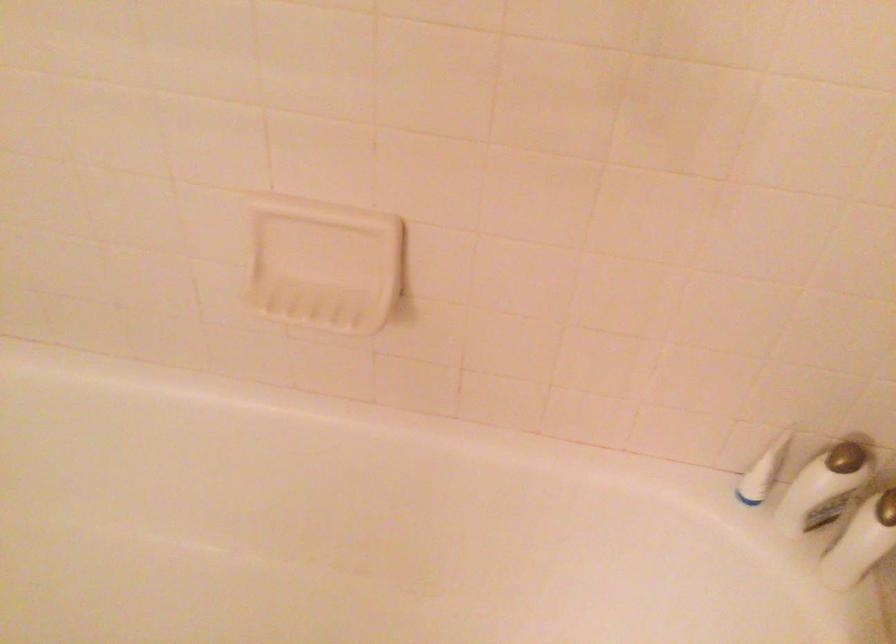
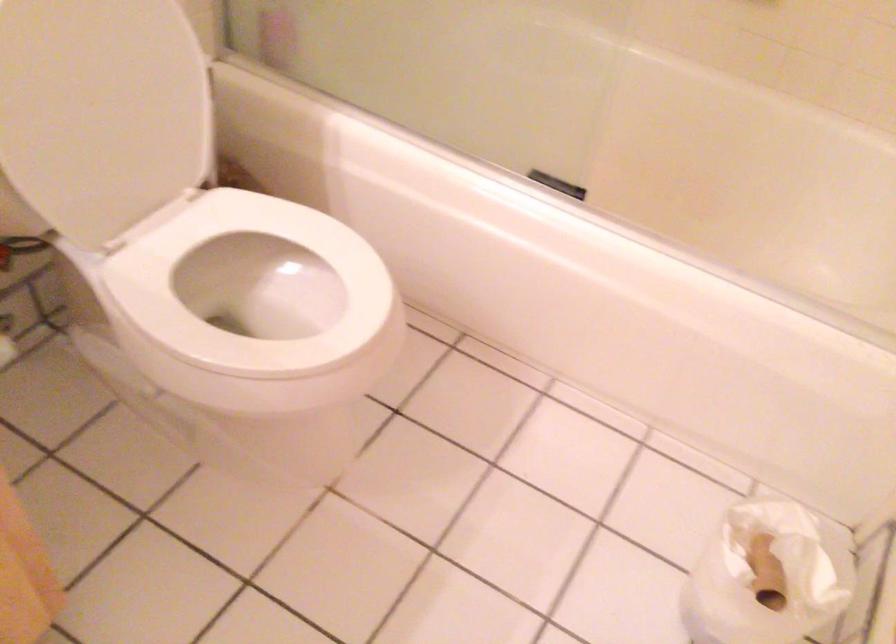
Question: What movement of the cameraman would produce the second image?

Choices:
 (A) Left
 (B) Right
 (C) Forward
 (D) Backward

Answer: (D)